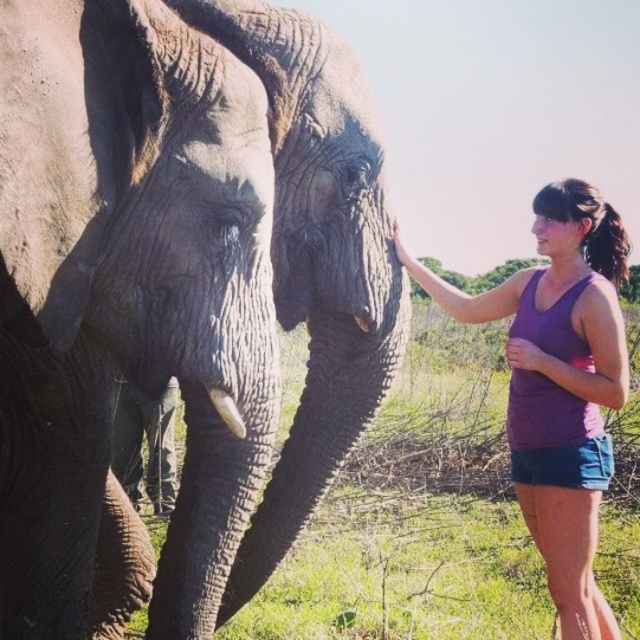
You are a wildlife photographer trying to capture a closeup shot of the white ivory tusk at lower left while avoiding the purple fabric tank top at upper right. Based on their sizes, which object should you focus on first to ensure it fits entirely within your camera frame?

The purple fabric tank top at upper right is larger than the white ivory tusk at lower left, so you should focus on the purple fabric tank top at upper right first to ensure it fits entirely within your camera frame.